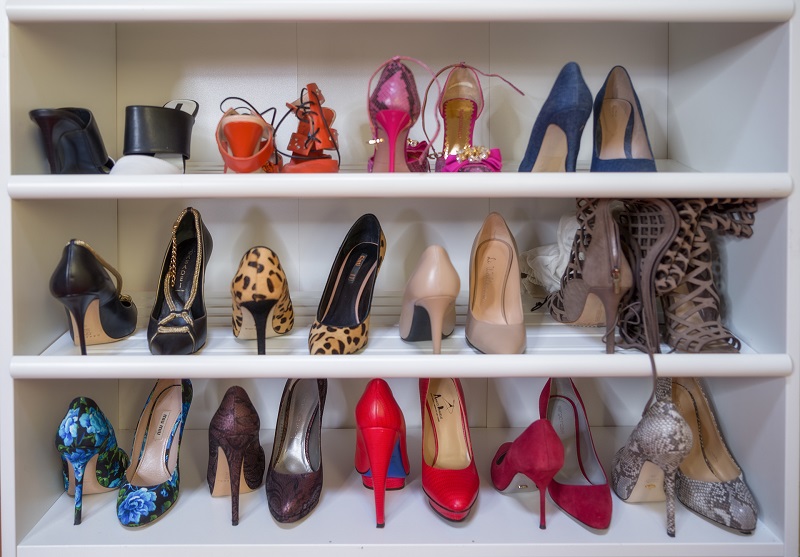
Identify the location of heels on last shelf. The height and width of the screenshot is (557, 800). (714, 476), (669, 451), (580, 502), (536, 465), (450, 482), (382, 442), (294, 487), (236, 431), (157, 458), (90, 437).